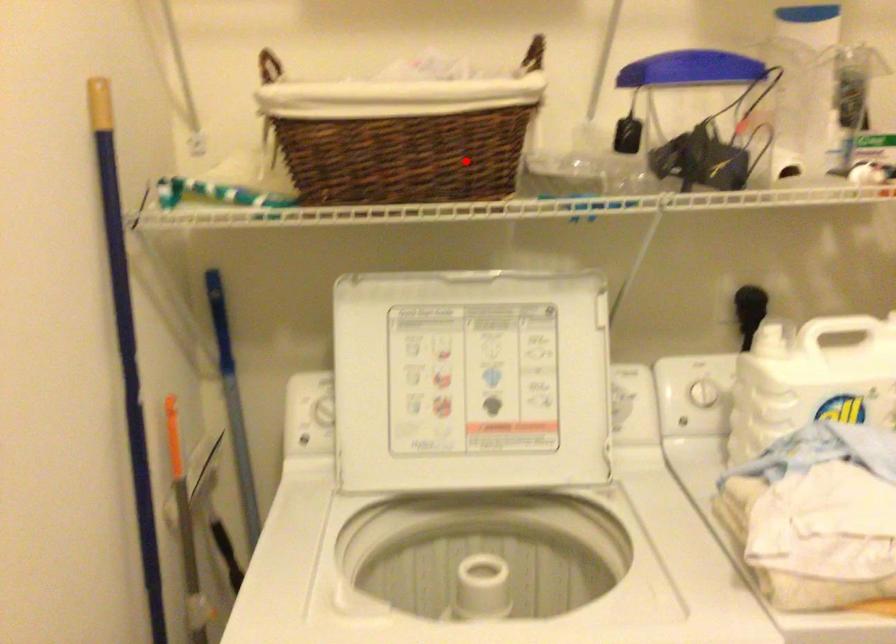
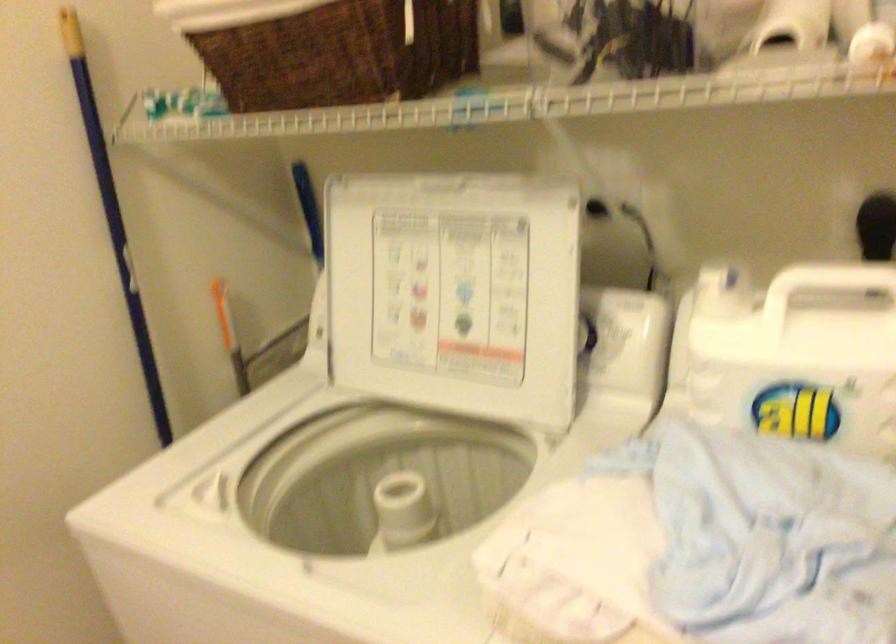
Question: I am providing you with two images of the same scene from different viewpoints. Given a red point in image1, look at the same physical point in image2. Is it:

Choices:
 (A) Closer to the viewpoint
 (B) Farther from the viewpoint

Answer: (A)